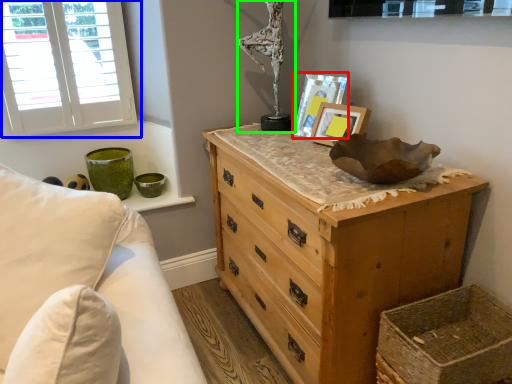
Question: Which object is the closest to the picture frame (highlighted by a red box)? Choose among these: window (highlighted by a blue box) or antique (highlighted by a green box).

Choices:
 (A) window
 (B) antique

Answer: (B)